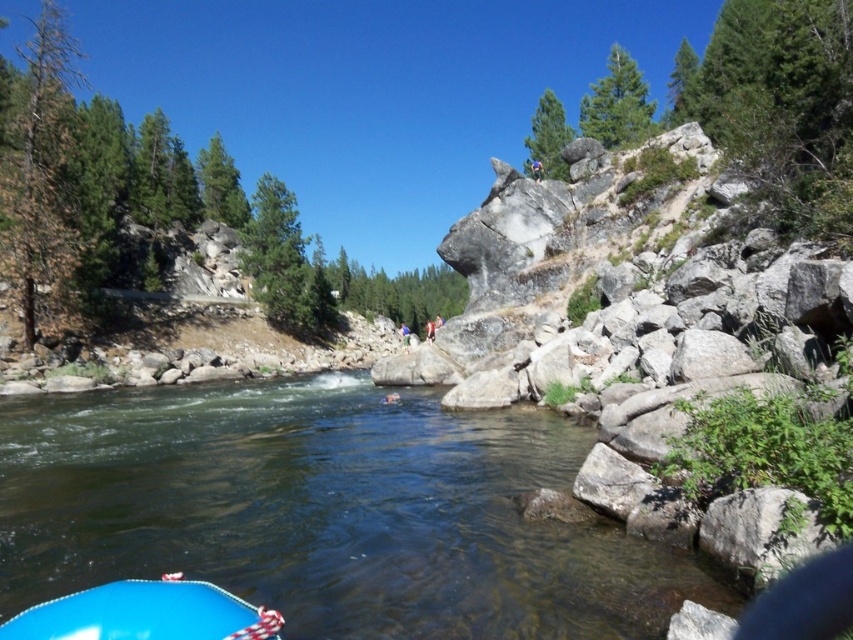
Identify the location of clear water at lower center. Image resolution: width=853 pixels, height=640 pixels. (326, 513).

Between point (225, 481) and point (404, 328), which one is positioned behind?

Point (404, 328)

Where is `clear water at lower center`? The image size is (853, 640). clear water at lower center is located at coordinates [326, 513].

The image size is (853, 640). In order to click on blue rubber boat at lower left in this screenshot , I will do `click(144, 612)`.

Can you confirm if blue rubber boat at lower left is positioned above blue fabric person at center?

Incorrect, blue rubber boat at lower left is not positioned above blue fabric person at center.

Is point (56, 636) closer to viewer compared to point (399, 333)?

Yes, point (56, 636) is closer to viewer.

Identify the location of blue rubber boat at lower left. The height and width of the screenshot is (640, 853). (144, 612).

Between clear water at lower center and blue rubber boat at lower left, which one is positioned higher?

blue rubber boat at lower left is above.

Does clear water at lower center have a lesser width compared to blue rubber boat at lower left?

In fact, clear water at lower center might be wider than blue rubber boat at lower left.

Find the location of a particular element. The width and height of the screenshot is (853, 640). clear water at lower center is located at coordinates (326, 513).